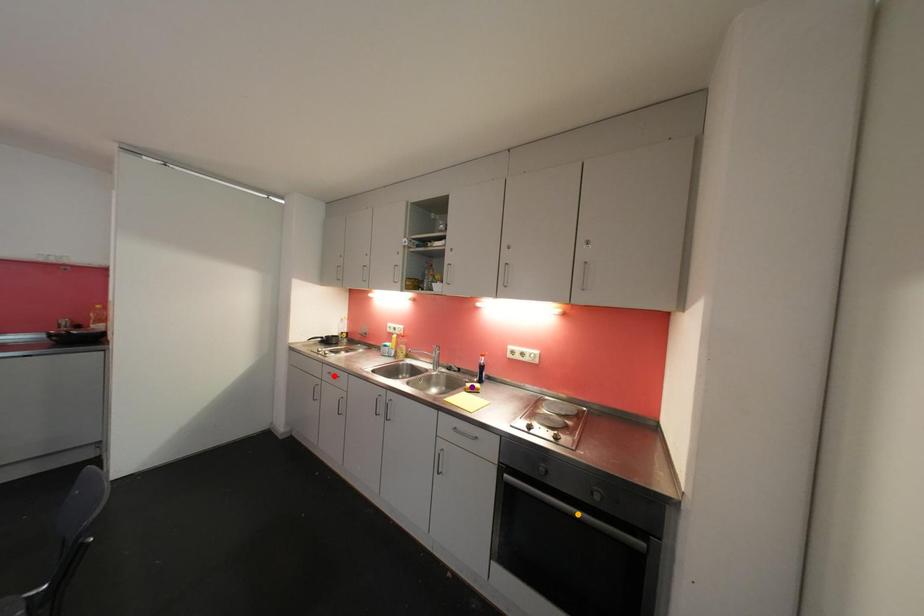
Order these from nearest to farthest:
- red point
- purple point
- orange point

red point, purple point, orange point